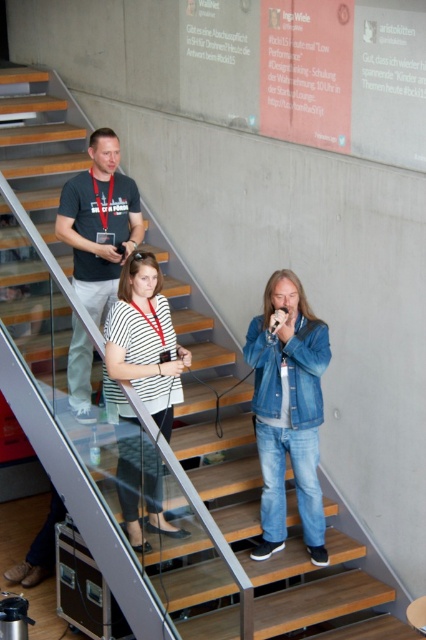
In the scene shown: Does striped cotton shirt at center appear on the right side of white striped shirt at center?

Yes, striped cotton shirt at center is to the right of white striped shirt at center.

Which of these two, striped cotton shirt at center or white striped shirt at center, stands shorter?

Standing shorter between the two is white striped shirt at center.

Describe the element at coordinates (287, 410) in the screenshot. I see `striped cotton shirt at center` at that location.

Where is `striped cotton shirt at center`? Image resolution: width=426 pixels, height=640 pixels. striped cotton shirt at center is located at coordinates (287, 410).

Is point (287, 394) less distant than point (103, 136)?

That is True.

Is striped cotton shirt at center closer to the viewer compared to matte black t-shirt at upper left?

Yes.

Is point (294, 308) closer to viewer compared to point (103, 260)?

Yes.

Image resolution: width=426 pixels, height=640 pixels. I want to click on striped cotton shirt at center, so click(287, 410).

Does white striped shirt at center appear over matte black t-shirt at upper left?

No, white striped shirt at center is not above matte black t-shirt at upper left.

The height and width of the screenshot is (640, 426). In order to click on white striped shirt at center in this screenshot , I will do [x=141, y=387].